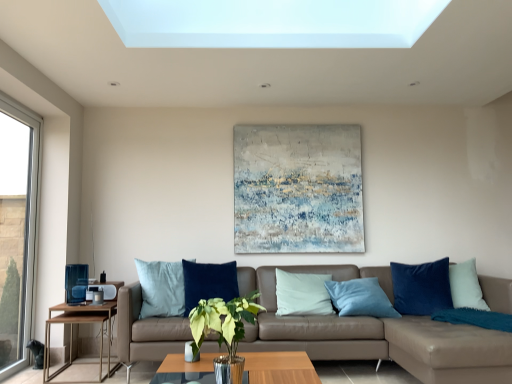
Where is `textured canvas painting at center`? The height and width of the screenshot is (384, 512). textured canvas painting at center is located at coordinates (297, 189).

Describe the element at coordinates (421, 287) in the screenshot. I see `velvet blue pillow at right` at that location.

What are the coordinates of `velvet blue pillow at right` in the screenshot? It's located at (421, 287).

Measure the distance between point [5,305] and camera.

A distance of 3.47 meters exists between point [5,305] and camera.

The width and height of the screenshot is (512, 384). I want to click on textured canvas painting at center, so click(297, 189).

Consider the image. From a real-world perspective, is clear glass window at left positioned over translucent glass coffee table at center based on gravity?

Yes, from a real-world perspective, clear glass window at left is above translucent glass coffee table at center.

Considering the points (14, 203) and (265, 362), which point is behind, point (14, 203) or point (265, 362)?

The point (14, 203) is more distant.

Is clear glass window at left surrounding translucent glass coffee table at center?

No, clear glass window at left does not contain translucent glass coffee table at center.

Is textured canvas painting at center completely or partially outside of clear glass window at left?

textured canvas painting at center lies outside clear glass window at left's area.

From a real-world perspective, is textured canvas painting at center on clear glass window at left?

Yes, from a real-world perspective, textured canvas painting at center is above clear glass window at left.

In the image, is textured canvas painting at center on the left side or the right side of clear glass window at left?

In the image, textured canvas painting at center appears on the right side of clear glass window at left.

From the image's perspective, is wooden/metallic side table at left above or below textured canvas painting at center?

wooden/metallic side table at left is situated lower than textured canvas painting at center in the image.

Does wooden/metallic side table at left come in front of textured canvas painting at center?

That is True.

Is wooden/metallic side table at left outside of textured canvas painting at center?

Yes, wooden/metallic side table at left is located beyond the bounds of textured canvas painting at center.

From the image's perspective, which is below, clear glass window at left or textured canvas painting at center?

clear glass window at left, from the image's perspective.

Is clear glass window at left inside the boundaries of textured canvas painting at center, or outside?

clear glass window at left is spatially situated outside textured canvas painting at center.

Based on the photo, how many degrees apart are the facing directions of clear glass window at left and textured canvas painting at center?

The angle between the facing direction of clear glass window at left and the facing direction of textured canvas painting at center is 91.4 degrees.

Who is bigger, clear glass window at left or textured canvas painting at center?

With larger size is clear glass window at left.

In order to click on studio couch to the right of wooden/metallic side table at left in this screenshot , I will do `click(377, 333)`.

From a real-world perspective, is leather couch at center physically below wooden/metallic side table at left?

Actually, leather couch at center is physically above wooden/metallic side table at left in the real world.

Considering the relative positions of leather couch at center and wooden/metallic side table at left in the image provided, is leather couch at center to the left of wooden/metallic side table at left from the viewer's perspective?

No.

In terms of width, does leather couch at center look wider or thinner when compared to wooden/metallic side table at left?

Clearly, leather couch at center has more width compared to wooden/metallic side table at left.

Considering the positions of objects leather couch at center and velvet blue pillow at right in the image provided, who is in front, leather couch at center or velvet blue pillow at right?

leather couch at center.

Is there a large distance between leather couch at center and velvet blue pillow at right?

leather couch at center is near velvet blue pillow at right, not far away.

Based on the photo, can you confirm if leather couch at center is positioned to the left of velvet blue pillow at right?

Yes.

Looking at this image, which is correct: leather couch at center is inside velvet blue pillow at right, or outside of it?

leather couch at center is not inside velvet blue pillow at right, it's outside.

Is translucent glass coffee table at center oriented towards clear glass window at left?

No.

Does point (184, 367) come farther from viewer compared to point (2, 240)?

No, (184, 367) is in front of (2, 240).

Would you say translucent glass coffee table at center contains clear glass window at left?

No, clear glass window at left is not a part of translucent glass coffee table at center.

Is translucent glass coffee table at center positioned far away from clear glass window at left?

That's right, there is a large distance between translucent glass coffee table at center and clear glass window at left.

This screenshot has height=384, width=512. I want to click on coffee table that is on the right side of clear glass window at left, so click(x=279, y=368).

Locate an element on the screen. The width and height of the screenshot is (512, 384). picture frame above the clear glass window at left (from the image's perspective) is located at coordinates (297, 189).

Looking at the image, which one is located closer to textured canvas painting at center, leather couch at center or translucent glass coffee table at center?

leather couch at center.

Which object lies further to the anchor point textured canvas painting at center, clear glass window at left or translucent glass coffee table at center?

clear glass window at left.

Looking at the image, which one is located further to velvet blue pillow at right, textured canvas painting at center or clear glass window at left?

clear glass window at left is positioned further to the anchor velvet blue pillow at right.

Looking at the image, which one is located closer to textured canvas painting at center, green leafy plant in glass vase at center or clear glass window at left?

green leafy plant in glass vase at center is positioned closer to the anchor textured canvas painting at center.

From the image, which object appears to be nearer to translucent glass coffee table at center, wooden/metallic side table at left or leather couch at center?

Based on the image, leather couch at center appears to be nearer to translucent glass coffee table at center.

From the image, which object appears to be nearer to clear glass window at left, green leafy plant in glass vase at center or velvet blue pillow at right?

The object closer to clear glass window at left is green leafy plant in glass vase at center.

Based on their spatial positions, is translucent glass coffee table at center or green leafy plant in glass vase at center further from clear glass window at left?

green leafy plant in glass vase at center is further to clear glass window at left.

When comparing their distances from velvet blue pillow at right, does translucent glass coffee table at center or textured canvas painting at center seem closer?

textured canvas painting at center is positioned closer to the anchor velvet blue pillow at right.

You are a GUI agent. You are given a task and a screenshot of the screen. Output one action in this format:
    pyautogui.click(x=<x>, y=<y>)
    Task: Click on the studio couch between green leafy plant in glass vase at center and velvet blue pillow at right from front to back
    This screenshot has width=512, height=384.
    Given the screenshot: What is the action you would take?
    pyautogui.click(x=377, y=333)

The image size is (512, 384). I want to click on pillow between leather couch at center and textured canvas painting at center along the z-axis, so click(x=421, y=287).

Locate an element on the screen. This screenshot has height=384, width=512. coffee table between clear glass window at left and leather couch at center from left to right is located at coordinates (279, 368).

I want to click on pillow located between green leafy plant in glass vase at center and textured canvas painting at center in the depth direction, so click(421, 287).